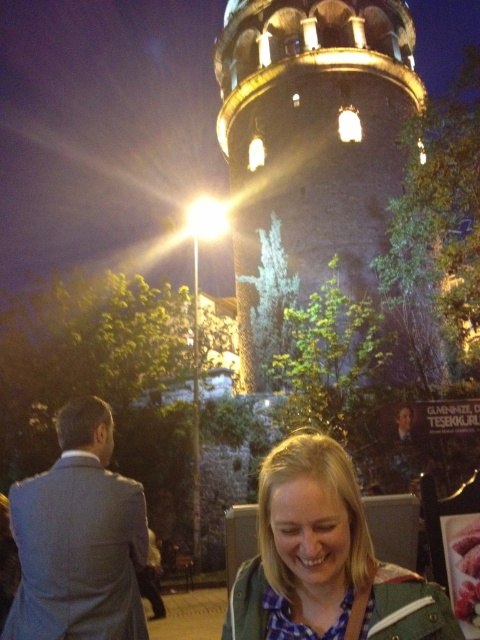
Question: In this image, where is blonde hair at lower center located relative to gray wool suit at left?

Choices:
 (A) right
 (B) left

Answer: (A)

Question: Does stone tower at center have a greater width compared to gray wool suit at left?

Choices:
 (A) yes
 (B) no

Answer: (A)

Question: Among these points, which one is farthest from the camera?

Choices:
 (A) (228, 45)
 (B) (108, 436)

Answer: (A)

Question: Which object is closer to the camera taking this photo?

Choices:
 (A) blonde hair at lower center
 (B) gray wool suit at left

Answer: (A)

Question: Among these objects, which one is nearest to the camera?

Choices:
 (A) gray wool suit at left
 (B) blonde hair at lower center

Answer: (B)

Question: Can you confirm if stone tower at center is positioned above blonde hair at lower center?

Choices:
 (A) no
 (B) yes

Answer: (B)